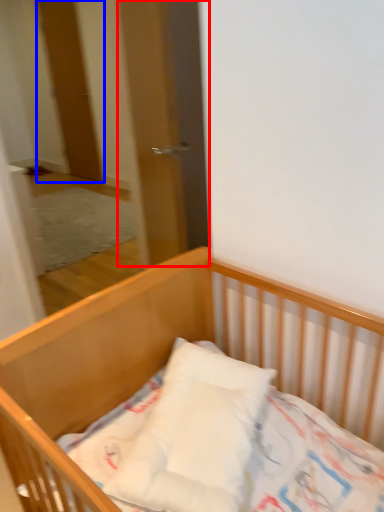
Question: Which of the following is the farthest to the observer, screen door (highlighted by a red box) or door (highlighted by a blue box)?

Choices:
 (A) screen door
 (B) door

Answer: (B)